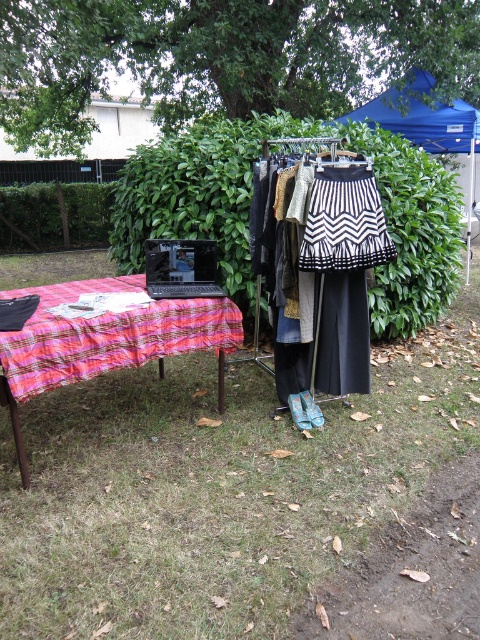
You are a customer at the outdoor market and want to place a small item on the ground between the green grass at lower center and the plaid fabric picnic table at left. What is the minimum distance you need to ensure the item doesn

The minimum distance you need to ensure the item can be placed between the green grass at lower center and the plaid fabric picnic table at left is 32.58 inches, as that is the distance between them.

From the picture: You are setting up a tent for an event, and you need to determine if the plaid fabric picnic table at left can fit under the blue fabric canopy at upper right. Based on their heights, will the table fit without any issues?

The plaid fabric picnic table at left is shorter than the blue fabric canopy at upper right, so the table can fit under the canopy without any issues.

What is the exact coordinate position of the green grass at lower center in the image?

The green grass at lower center is located at point (217, 490).